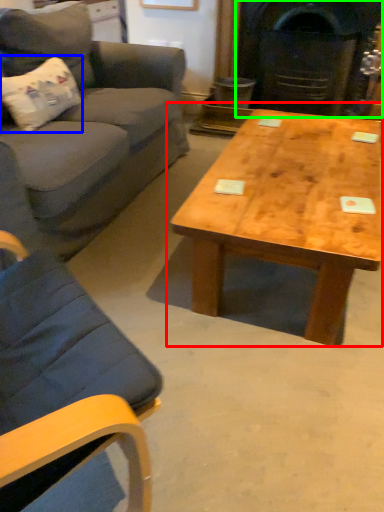
Question: Considering the real-world distances, which object is closest to coffee table (highlighted by a red box)? pillow (highlighted by a blue box) or fireplace (highlighted by a green box).

Choices:
 (A) pillow
 (B) fireplace

Answer: (A)